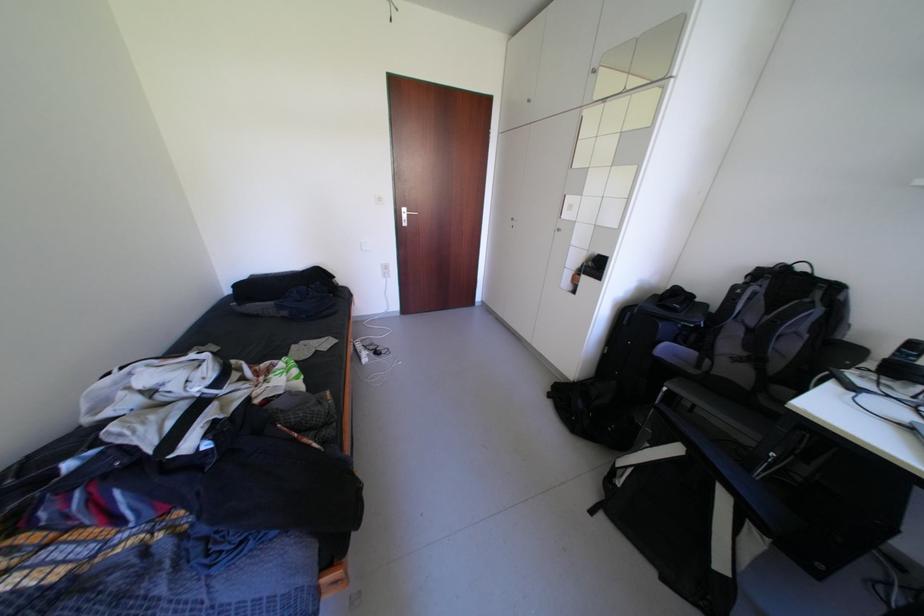
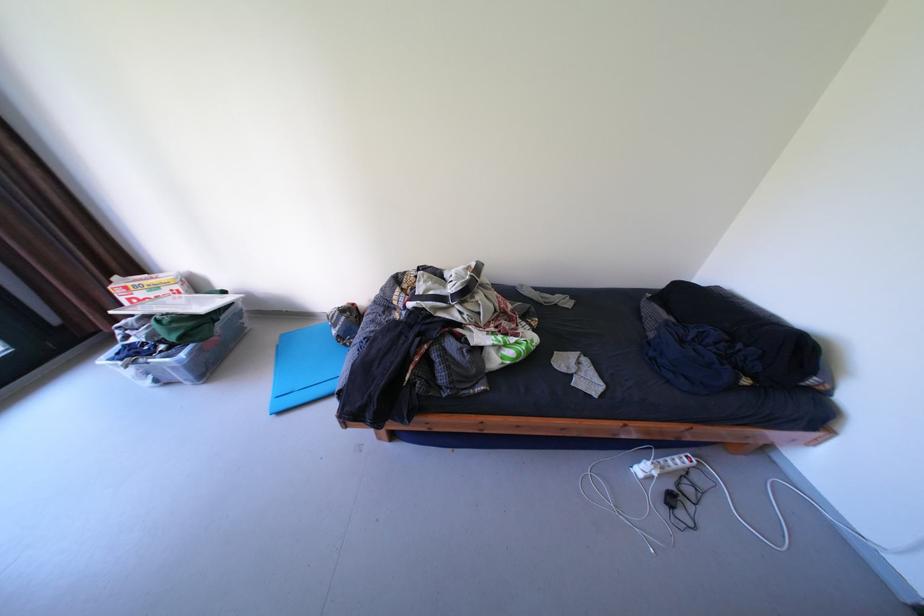
Find the pixel in the second image that matches (375,361) in the first image.

(649, 471)